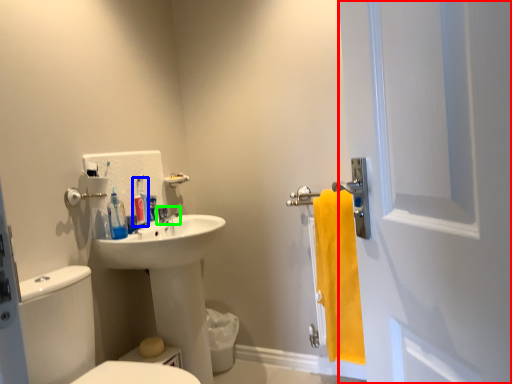
Question: Which object is positioned farthest from screen door (highlighted by a red box)? Select from toiletry (highlighted by a blue box) and tap (highlighted by a green box).

Choices:
 (A) toiletry
 (B) tap

Answer: (A)